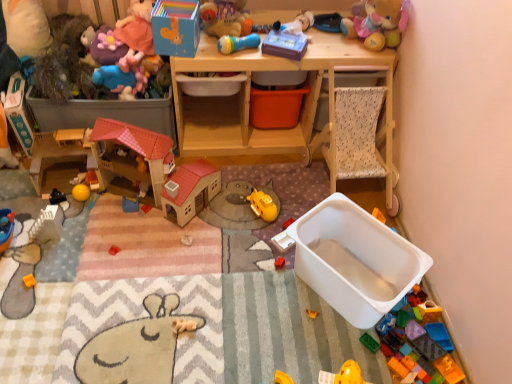
Locate an element on the screen. This screenshot has width=512, height=384. vacant space that is to the left of rubberized plastic microphone at upper center, which is the eighth toy from left to right is located at coordinates (205, 49).